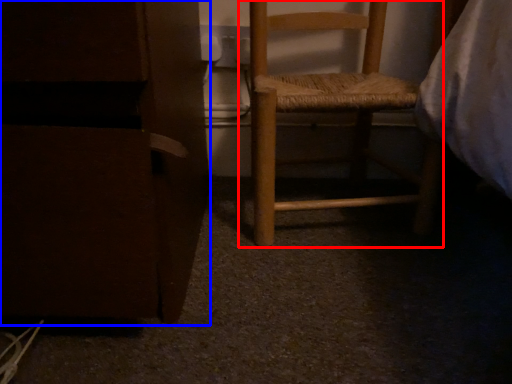
Question: Among these objects, which one is nearest to the camera, furniture (highlighted by a red box) or furniture (highlighted by a blue box)?

Choices:
 (A) furniture
 (B) furniture

Answer: (B)